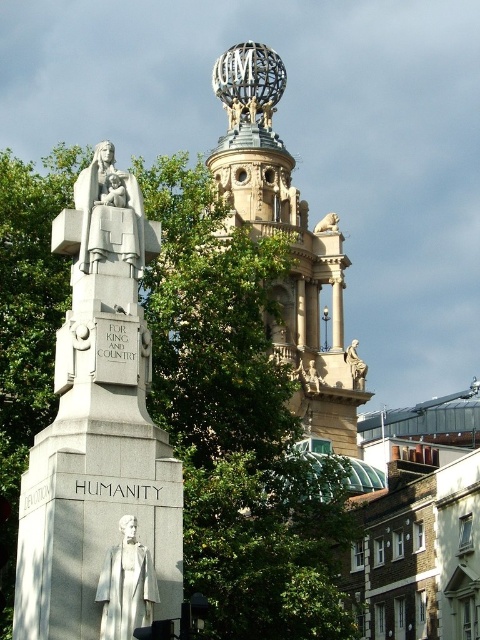
Question: Is gold ornate tower at center positioned at the back of white marble statue at center?

Choices:
 (A) no
 (B) yes

Answer: (B)

Question: Can you confirm if gold ornate tower at center is positioned above polished bronze statue at upper right?

Choices:
 (A) yes
 (B) no

Answer: (A)

Question: Can you confirm if gold ornate tower at center is smaller than white marble statue at center?

Choices:
 (A) no
 (B) yes

Answer: (A)

Question: Which of the following is the farthest from the observer?

Choices:
 (A) white marble statue at upper left
 (B) gold ornate tower at center
 (C) marble lion at upper center

Answer: (C)

Question: Which point is closer to the camera taking this photo?

Choices:
 (A) (136, 228)
 (B) (299, 305)

Answer: (A)

Question: Which point is farther to the camera?

Choices:
 (A) polished bronze statue at upper right
 (B) gold ornate tower at center

Answer: (A)